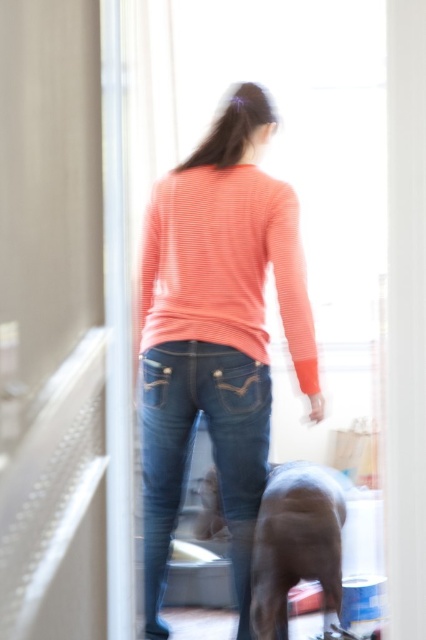
Question: Which of the following is the closest to the observer?

Choices:
 (A) matte coral sweater at center
 (B) coral striped sweater at center
 (C) shiny brown dog at lower center
 (D) denim jeans at center

Answer: (C)

Question: Considering the real-world distances, which object is farthest from the coral striped sweater at center?

Choices:
 (A) matte coral sweater at center
 (B) denim jeans at center

Answer: (B)

Question: Can you confirm if matte coral sweater at center is positioned above denim jeans at center?

Choices:
 (A) yes
 (B) no

Answer: (A)

Question: Where is denim jeans at center located in relation to shiny brown dog at lower center in the image?

Choices:
 (A) below
 (B) above

Answer: (B)

Question: Is coral striped sweater at center positioned at the back of denim jeans at center?

Choices:
 (A) yes
 (B) no

Answer: (B)

Question: Which object appears farthest from the camera in this image?

Choices:
 (A) matte coral sweater at center
 (B) shiny brown dog at lower center
 (C) denim jeans at center

Answer: (C)